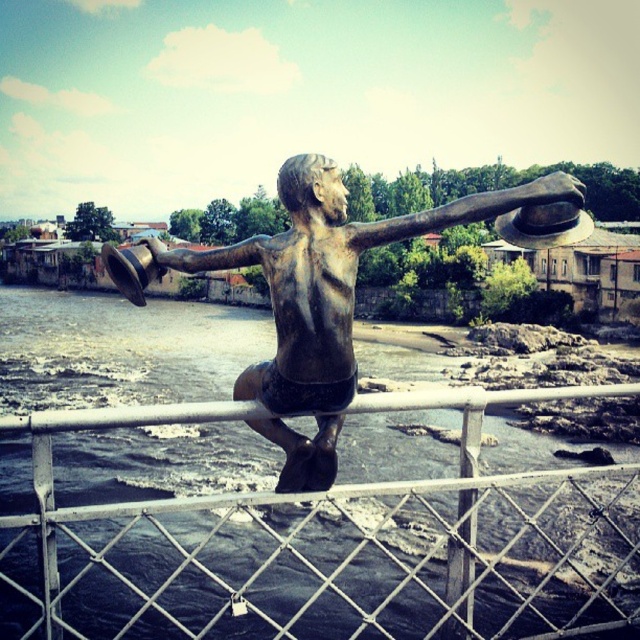
You are a painter standing on the bridge. You want to paint both the bronze statue at center and the white metal fence at center. Which object should you look up to paint?

The white metal fence at center is much taller than the bronze statue at center, so you should look up to paint the white metal fence at center.

You are standing on the bridge and want to place a 3.5 meter long banner between the bronze statue at center and the white metal fence at center. Can the banner fit between them without overlapping either object?

The distance between the bronze statue at center and the white metal fence at center is 5.00 meters. Since the banner is 3.5 meters long, it can fit between them with 1.5 meters of space remaining on each side.

You are standing on the bridge looking at the bronze statue at center and the white metal fence at center. Which object is closer to you?

The white metal fence at center is closer to you than the bronze statue at center because it is further to the viewer.